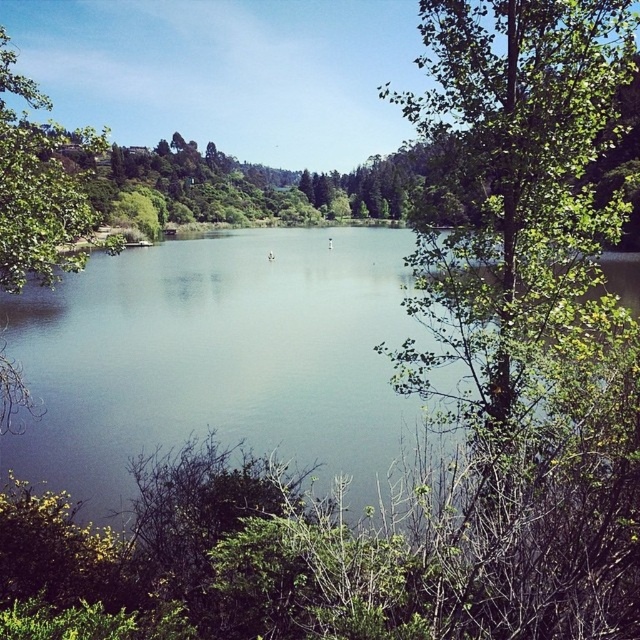
Question: Can you confirm if clear water at center is thinner than green leafy tree at upper left?

Choices:
 (A) yes
 (B) no

Answer: (B)

Question: Which of the following is the closest to the observer?

Choices:
 (A) clear water at center
 (B) green leafy tree at upper left

Answer: (A)

Question: Which object appears closest to the camera in this image?

Choices:
 (A) green leafy tree at upper left
 (B) green leafy tree at right

Answer: (B)

Question: Is clear water at center positioned in front of green leafy tree at upper left?

Choices:
 (A) yes
 (B) no

Answer: (A)

Question: Which point is closer to the camera?

Choices:
 (A) green leafy tree at right
 (B) clear water at center
 (C) green leafy tree at upper left

Answer: (A)

Question: Can you confirm if green leafy tree at right is thinner than green leafy tree at upper left?

Choices:
 (A) yes
 (B) no

Answer: (A)